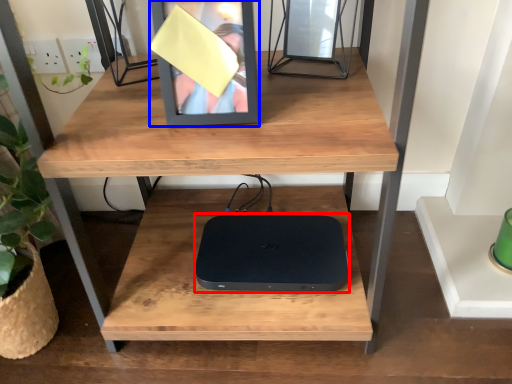
Question: Which object is further to the camera taking this photo, computer (highlighted by a red box) or picture frame (highlighted by a blue box)?

Choices:
 (A) computer
 (B) picture frame

Answer: (A)